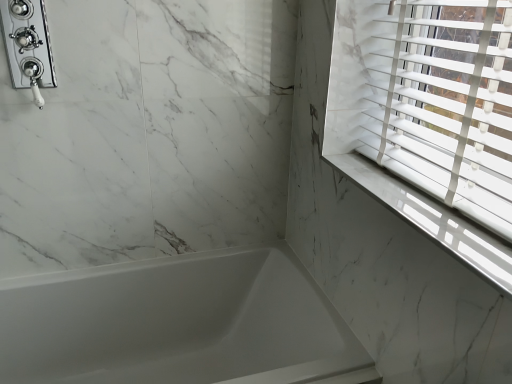
What is the approximate height of white glossy bathtub at lower left?

It is 23.23 inches.

Describe the element at coordinates (432, 219) in the screenshot. I see `white marble window sill at upper right` at that location.

This screenshot has height=384, width=512. What are the coordinates of `chrome/polished metal shower at upper left` in the screenshot? It's located at (28, 45).

I want to click on bathtub below the chrome/polished metal shower at upper left (from the image's perspective), so click(178, 324).

Is chrome/polished metal shower at upper left situated inside white glossy bathtub at lower left or outside?

The correct answer is: outside.

From the image's perspective, is chrome/polished metal shower at upper left located beneath white glossy bathtub at lower left?

Incorrect, from the image's perspective, chrome/polished metal shower at upper left is higher than white glossy bathtub at lower left.

Does chrome/polished metal shower at upper left lie behind white glossy bathtub at lower left?

Yes, chrome/polished metal shower at upper left is further from the viewer.

Is white glossy bathtub at lower left to the left or to the right of white marble window sill at upper right in the image?

Clearly, white glossy bathtub at lower left is on the left of white marble window sill at upper right in the image.

Considering the relative sizes of white glossy bathtub at lower left and white marble window sill at upper right in the image provided, is white glossy bathtub at lower left smaller than white marble window sill at upper right?

Incorrect, white glossy bathtub at lower left is not smaller in size than white marble window sill at upper right.

Is white glossy bathtub at lower left positioned beyond the bounds of white marble window sill at upper right?

Yes, white glossy bathtub at lower left is located beyond the bounds of white marble window sill at upper right.

Considering the sizes of objects white marble window sill at upper right and white glossy bathtub at lower left in the image provided, who is taller, white marble window sill at upper right or white glossy bathtub at lower left?

white glossy bathtub at lower left is taller.

From a real-world perspective, is white marble window sill at upper right positioned over white glossy bathtub at lower left based on gravity?

Yes, from a real-world perspective, white marble window sill at upper right is over white glossy bathtub at lower left

This screenshot has width=512, height=384. Find the location of `window sill above the white glossy bathtub at lower left (from a real-world perspective)`. window sill above the white glossy bathtub at lower left (from a real-world perspective) is located at coordinates (432, 219).

Is white marble window sill at upper right oriented towards white glossy bathtub at lower left?

No, white marble window sill at upper right is not turned towards white glossy bathtub at lower left.

Is chrome/polished metal shower at upper left beside white marble window sill at upper right?

There is a gap between chrome/polished metal shower at upper left and white marble window sill at upper right.

Considering the sizes of objects chrome/polished metal shower at upper left and white marble window sill at upper right in the image provided, who is wider, chrome/polished metal shower at upper left or white marble window sill at upper right?

white marble window sill at upper right.

Consider the image. Considering the sizes of objects chrome/polished metal shower at upper left and white marble window sill at upper right in the image provided, who is bigger, chrome/polished metal shower at upper left or white marble window sill at upper right?

chrome/polished metal shower at upper left is bigger.

From the image's perspective, is chrome/polished metal shower at upper left located above white marble window sill at upper right?

Correct, chrome/polished metal shower at upper left appears higher than white marble window sill at upper right in the image.

At what (x,y) coordinates should I click in order to perform the action: click on shower above the white glossy bathtub at lower left (from the image's perspective). Please return your answer as a coordinate pair (x, y). This screenshot has width=512, height=384. Looking at the image, I should click on (28, 45).

Which object is thinner, white glossy bathtub at lower left or chrome/polished metal shower at upper left?

With smaller width is chrome/polished metal shower at upper left.

Is white glossy bathtub at lower left completely or partially outside of chrome/polished metal shower at upper left?

Indeed, white glossy bathtub at lower left is completely outside chrome/polished metal shower at upper left.

How different are the orientations of white marble window sill at upper right and chrome/polished metal shower at upper left in degrees?

There is a 88.7-degree angle between the facing directions of white marble window sill at upper right and chrome/polished metal shower at upper left.

Is white marble window sill at upper right facing towards chrome/polished metal shower at upper left?

No, white marble window sill at upper right is not turned towards chrome/polished metal shower at upper left.

Does white marble window sill at upper right lie behind chrome/polished metal shower at upper left?

No, white marble window sill at upper right is closer to the camera.

In order to click on window sill beneath the chrome/polished metal shower at upper left (from a real-world perspective) in this screenshot , I will do `click(432, 219)`.

Where is `bathtub on the right of chrome/polished metal shower at upper left`? The image size is (512, 384). bathtub on the right of chrome/polished metal shower at upper left is located at coordinates (178, 324).

This screenshot has width=512, height=384. I want to click on window sill above the white glossy bathtub at lower left (from the image's perspective), so click(432, 219).

Considering their positions, is white marble window sill at upper right positioned closer to chrome/polished metal shower at upper left than white glossy bathtub at lower left?

white glossy bathtub at lower left is closer to chrome/polished metal shower at upper left.

Estimate the real-world distances between objects in this image. Which object is further from white marble window sill at upper right, white glossy bathtub at lower left or chrome/polished metal shower at upper left?

chrome/polished metal shower at upper left.

Which object lies nearer to the anchor point white marble window sill at upper right, chrome/polished metal shower at upper left or white glossy bathtub at lower left?

white glossy bathtub at lower left is closer to white marble window sill at upper right.

Based on their spatial positions, is white marble window sill at upper right or chrome/polished metal shower at upper left further from white glossy bathtub at lower left?

Among the two, chrome/polished metal shower at upper left is located further to white glossy bathtub at lower left.

Looking at the image, which one is located closer to white glossy bathtub at lower left, chrome/polished metal shower at upper left or white marble window sill at upper right?

Based on the image, white marble window sill at upper right appears to be nearer to white glossy bathtub at lower left.

Looking at the image, which one is located closer to chrome/polished metal shower at upper left, white glossy bathtub at lower left or white marble window sill at upper right?

white glossy bathtub at lower left lies closer to chrome/polished metal shower at upper left than the other object.

Where is `window sill between chrome/polished metal shower at upper left and white glossy bathtub at lower left from top to bottom`? The width and height of the screenshot is (512, 384). window sill between chrome/polished metal shower at upper left and white glossy bathtub at lower left from top to bottom is located at coordinates (432, 219).